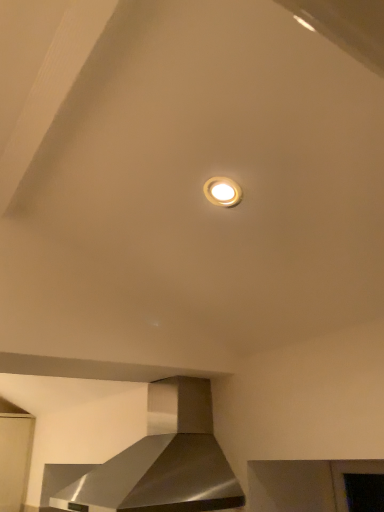
Locate an element on the screen. The image size is (384, 512). stainless steel vent at lower center is located at coordinates (156, 462).

This screenshot has height=512, width=384. What do you see at coordinates (156, 462) in the screenshot?
I see `stainless steel vent at lower center` at bounding box center [156, 462].

You are a GUI agent. You are given a task and a screenshot of the screen. Output one action in this format:
    pyautogui.click(x=<x>, y=<y>)
    Task: Click on the stainless steel vent at lower center
    The width and height of the screenshot is (384, 512).
    Given the screenshot: What is the action you would take?
    pyautogui.click(x=156, y=462)